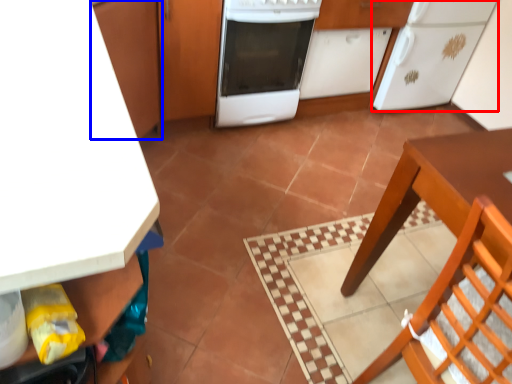
Question: Which object is closer to the camera taking this photo, kitchen appliance (highlighted by a red box) or cabinetry (highlighted by a blue box)?

Choices:
 (A) kitchen appliance
 (B) cabinetry

Answer: (B)